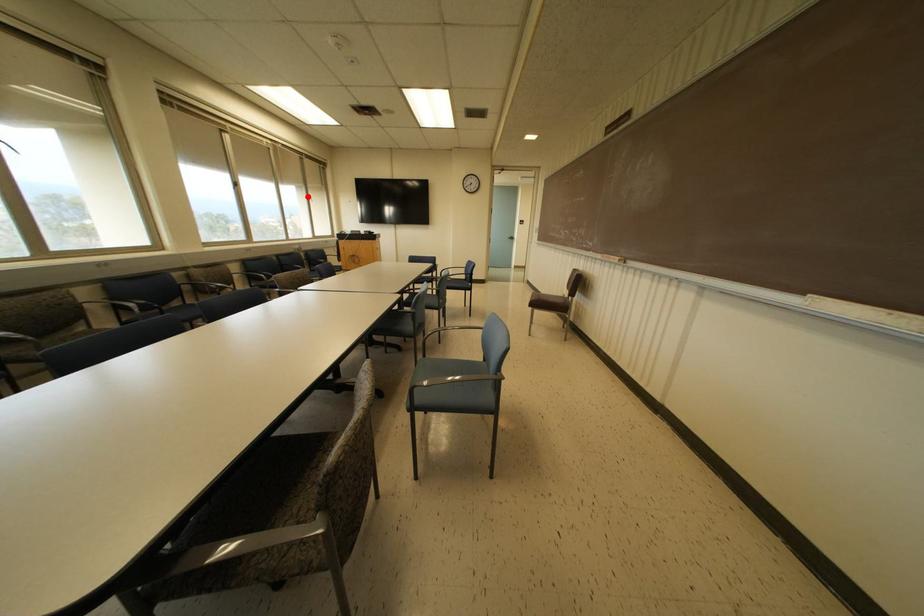
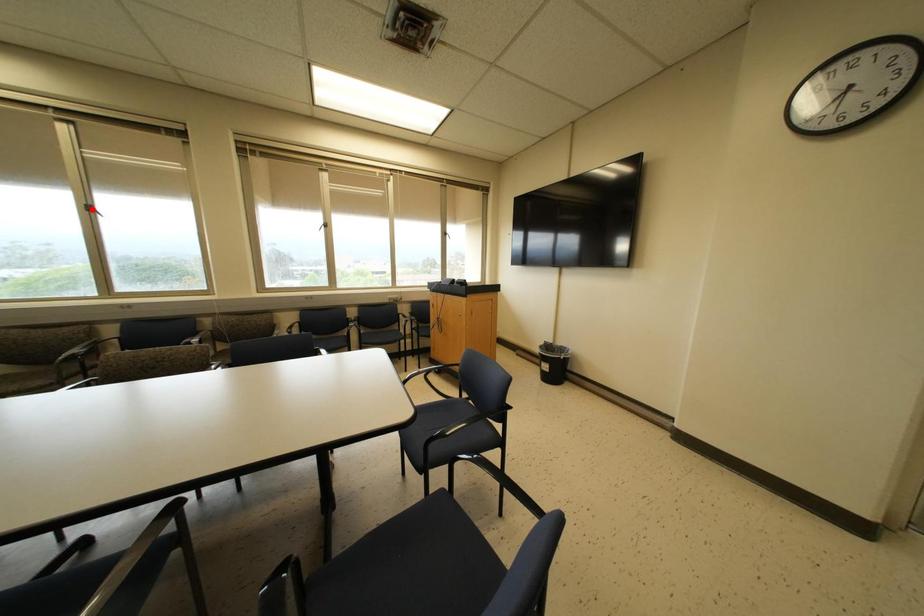
I am providing you with two images of the same scene from different viewpoints. A red point is marked on the first image and another point is marked on the second image. Are the points marked in image1 and image2 representing the same 3D position?

No